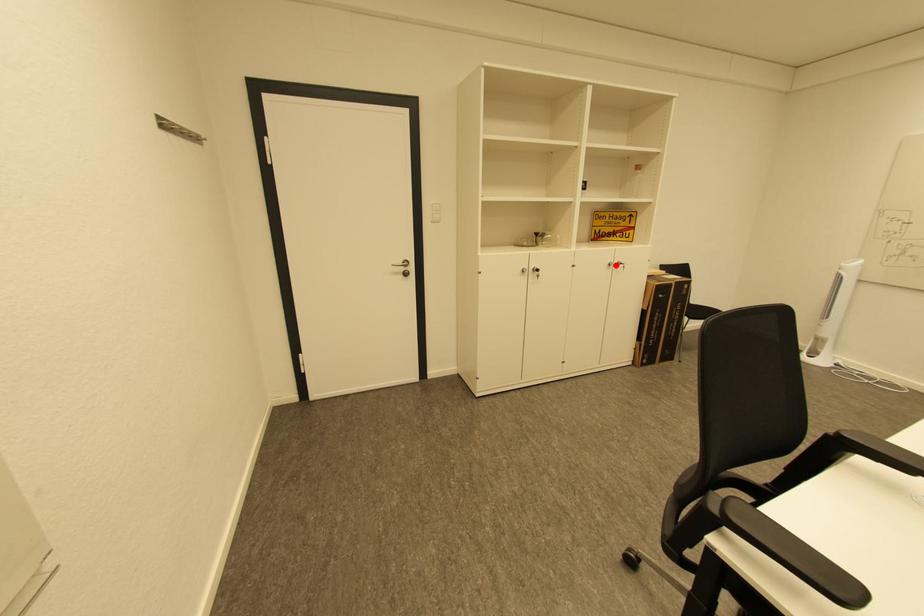
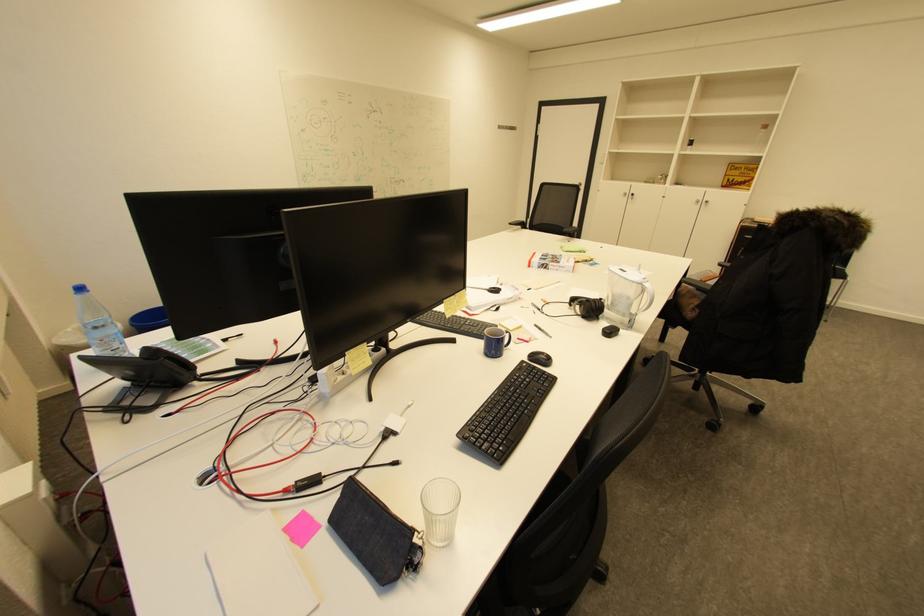
In the second image, find the point that corresponds to the highlighted location in the first image.

(703, 201)